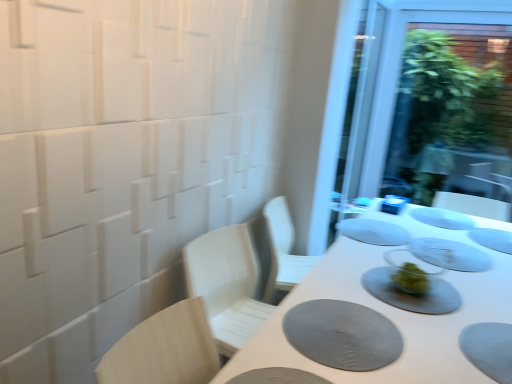
Identify the location of empty space that is ontop of transparent glass screen door at upper right (from a real-world perspective). (465, 8).